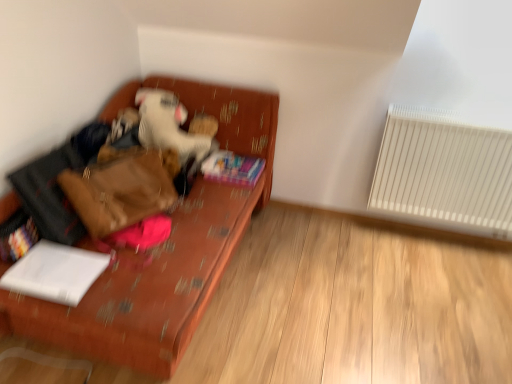
Question: From the image's perspective, is multicolored plastic book at lower left, the first book viewed from the left, above or below white plush toy at center?

Choices:
 (A) above
 (B) below

Answer: (B)

Question: In the image, is multicolored plastic book at lower left, which is counted as the second book, starting from the top, on the left side or the right side of white plush toy at center?

Choices:
 (A) left
 (B) right

Answer: (A)

Question: Estimate the real-world distances between objects in this image. Which object is farther from the white paper at lower left, marked as the 1th book in a bottom-to-top arrangement?

Choices:
 (A) multicolored paper book at center, which appears as the third book when viewed from the left
 (B) white plush toy at center
 (C) white plastic radiator at right
 (D) textured orange couch at left
 (E) multicolored plastic book at lower left, which ranks as the second book in front-to-back order

Answer: (C)

Question: Estimate the real-world distances between objects in this image. Which object is closer to the multicolored paper book at center, arranged as the 1th book when viewed from the right?

Choices:
 (A) multicolored plastic book at lower left, positioned as the second book in back-to-front order
 (B) textured orange couch at left
 (C) white paper at lower left, placed as the second book when sorted from right to left
 (D) white plastic radiator at right
 (E) white plush toy at center

Answer: (E)